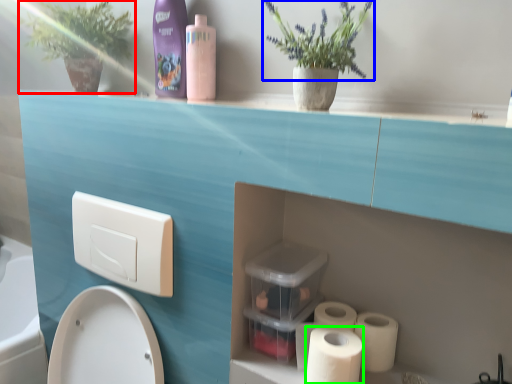
Question: Which is farther away from plant (highlighted by a red box)? flower (highlighted by a blue box) or toilet paper (highlighted by a green box)?

Choices:
 (A) flower
 (B) toilet paper

Answer: (B)